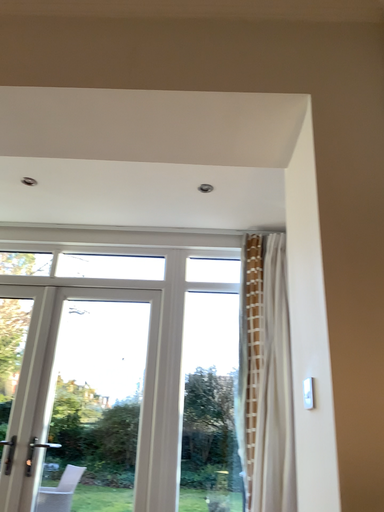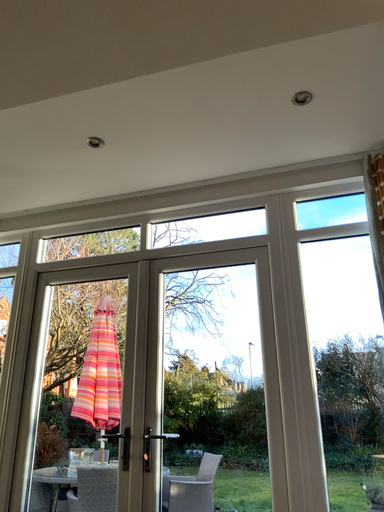
Question: Which way did the camera rotate in the video?

Choices:
 (A) rotated right
 (B) rotated left

Answer: (B)